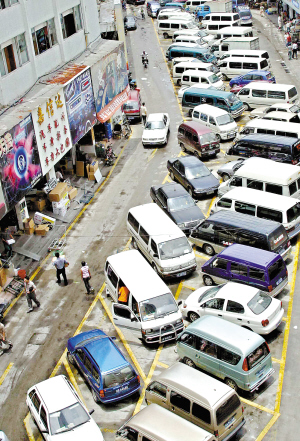
Find the location of a particular element. The image size is (300, 441). cardboard boxes is located at coordinates (30, 223), (30, 227), (42, 228), (2, 276), (55, 192), (41, 205), (72, 194), (79, 171), (93, 166), (92, 174).